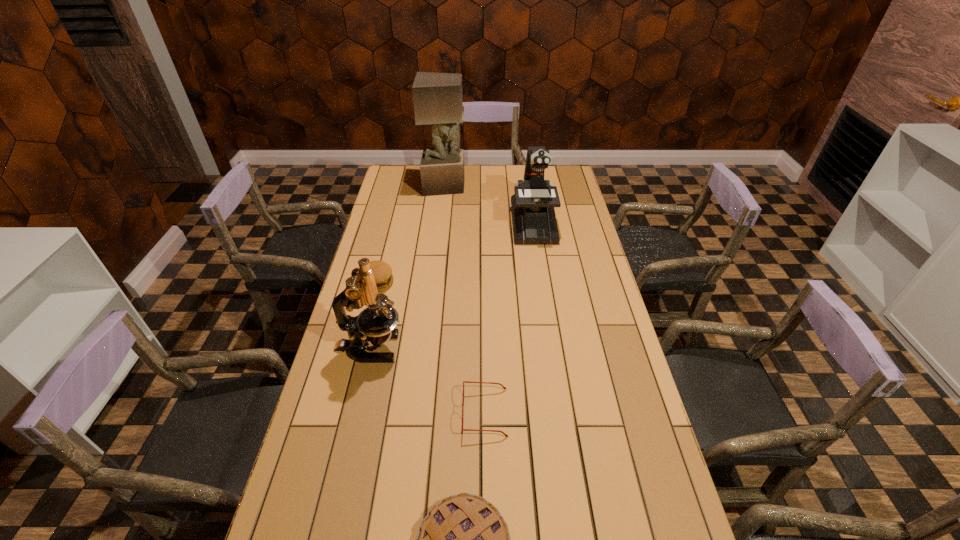
Where is `the farthest object`? the farthest object is located at coordinates (437, 97).

Locate an element on the screen. The height and width of the screenshot is (540, 960). sculpture is located at coordinates (437, 97).

Image resolution: width=960 pixels, height=540 pixels. I want to click on the right microscope, so click(532, 206).

The width and height of the screenshot is (960, 540). What are the coordinates of `the farther microscope` in the screenshot? It's located at (532, 206).

Where is `the nearer microscope`? The image size is (960, 540). the nearer microscope is located at coordinates (378, 321).

This screenshot has width=960, height=540. What are the coordinates of `the left microscope` in the screenshot? It's located at (378, 321).

The height and width of the screenshot is (540, 960). Identify the location of the fourth nearest object. (383, 276).

Image resolution: width=960 pixels, height=540 pixels. I want to click on the fourth tallest object, so click(383, 276).

Image resolution: width=960 pixels, height=540 pixels. I want to click on the fifth farthest object, so click(506, 435).

This screenshot has width=960, height=540. In order to click on spectacles in this screenshot , I will do `click(506, 435)`.